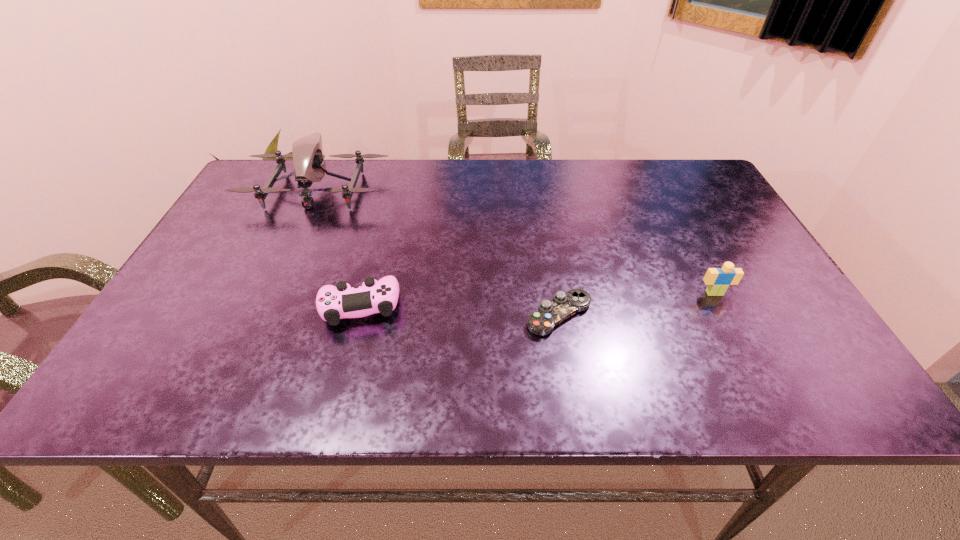
The height and width of the screenshot is (540, 960). I want to click on vacant point located between the drone and the right control, so click(x=439, y=252).

The width and height of the screenshot is (960, 540). In order to click on vacant area that lies between the second object from right to left and the drone in this screenshot , I will do click(439, 252).

Find the location of a particular element. This screenshot has height=540, width=960. vacant space in between the Lego and the shortest object is located at coordinates (636, 304).

The height and width of the screenshot is (540, 960). Find the location of `vacant space that's between the shortest object and the tallest object`. vacant space that's between the shortest object and the tallest object is located at coordinates (439, 252).

The width and height of the screenshot is (960, 540). What are the coordinates of `object that can be found as the closest to the shortest object` in the screenshot? It's located at [718, 280].

Image resolution: width=960 pixels, height=540 pixels. What are the coordinates of `object that is the third closest to the shorter control` in the screenshot? It's located at pos(307,155).

At what (x,y) coordinates should I click in order to perform the action: click on free region that satisfies the following two spatial constraints: 1. on the front side of the third object from left to right; 2. on the right side of the second shortest object. Please return your answer as a coordinate pair (x, y). The width and height of the screenshot is (960, 540). Looking at the image, I should click on (358, 315).

Where is `vacant space that satisfies the following two spatial constraints: 1. on the front-facing side of the drone; 2. on the left side of the second object from right to left`? vacant space that satisfies the following two spatial constraints: 1. on the front-facing side of the drone; 2. on the left side of the second object from right to left is located at coordinates (259, 315).

At what (x,y) coordinates should I click in order to perform the action: click on free space that satisfies the following two spatial constraints: 1. on the front-facing side of the shortest object; 2. on the right side of the drone. Please return your answer as a coordinate pair (x, y). Looking at the image, I should click on (259, 315).

I want to click on free location that satisfies the following two spatial constraints: 1. on the front-facing side of the third tallest object; 2. on the right side of the tallest object, so click(263, 306).